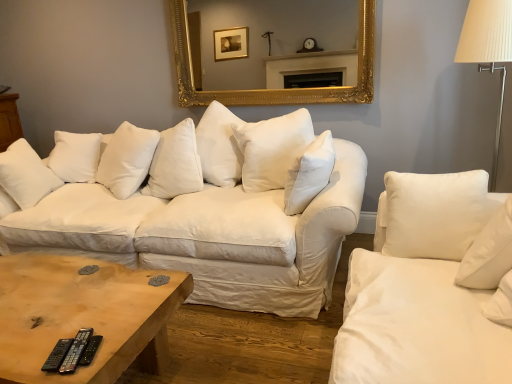
Question: From the image's perspective, is white cotton couch at center positioned above or below black plastic remote at lower left, which is counted as the 1th remote, starting from the right?

Choices:
 (A) below
 (B) above

Answer: (B)

Question: Considering the positions of point (173, 135) and point (90, 340), is point (173, 135) closer or farther from the camera than point (90, 340)?

Choices:
 (A) farther
 (B) closer

Answer: (A)

Question: Considering the real-world distances, which object is farthest from the gold ornate mirror at upper center?

Choices:
 (A) white cotton pillow at center, which is the 1th pillow from right to left
 (B) wooden coffee table at center
 (C) white fabric lampshade at right
 (D) white soft pillow at center, which appears as the 1th pillow when viewed from the back
 (E) black plastic remote at lower left, which is counted as the 1th remote, starting from the right

Answer: (E)

Question: Which object is the farthest from the black plastic remote at lower left, which is counted as the 1th remote, starting from the right?

Choices:
 (A) black rubber remote at lower left, arranged as the first remote when viewed from the left
 (B) gold ornate mirror at upper center
 (C) white soft pillow at center, which is the second pillow from front to back
 (D) white fabric lampshade at right
 (E) white cotton couch at center

Answer: (B)